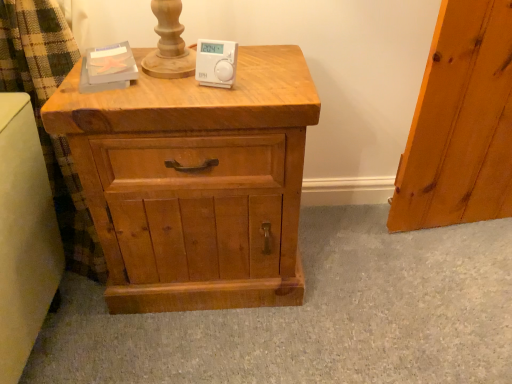
This screenshot has width=512, height=384. Find the location of `natural wood chest of drawers at center`. natural wood chest of drawers at center is located at coordinates (195, 182).

Image resolution: width=512 pixels, height=384 pixels. Describe the element at coordinates (195, 182) in the screenshot. I see `natural wood chest of drawers at center` at that location.

What is the approximate height of natural wood chest of drawers at center?

It is 67.10 centimeters.

What is the approximate height of white plastic thermostat at center?

The height of white plastic thermostat at center is 9.66 centimeters.

At what (x,y) coordinates should I click in order to perform the action: click on white plastic thermostat at center. Please return your answer as a coordinate pair (x, y). This screenshot has width=512, height=384. Looking at the image, I should click on (216, 63).

Describe the element at coordinates (216, 63) in the screenshot. The image size is (512, 384). I see `white plastic thermostat at center` at that location.

Where is `natural wood chest of drawers at center`? The width and height of the screenshot is (512, 384). natural wood chest of drawers at center is located at coordinates (195, 182).

Which object is positioned more to the right, white plastic thermostat at center or natural wood chest of drawers at center?

From the viewer's perspective, white plastic thermostat at center appears more on the right side.

Is white plastic thermostat at center positioned behind natural wood chest of drawers at center?

Yes, it is.

Between point (227, 53) and point (60, 121), which one is positioned in front?

The point (60, 121) is closer.

In the scene shown: From the image's perspective, is white plastic thermostat at center located beneath natural wood chest of drawers at center?

No.

From a real-world perspective, between white plastic thermostat at center and natural wood chest of drawers at center, who is vertically lower?

natural wood chest of drawers at center.

Considering the relative sizes of white plastic thermostat at center and natural wood chest of drawers at center in the image provided, is white plastic thermostat at center wider than natural wood chest of drawers at center?

No, white plastic thermostat at center is not wider than natural wood chest of drawers at center.

Which of these two, white plastic thermostat at center or natural wood chest of drawers at center, stands shorter?

white plastic thermostat at center is shorter.

Considering the sizes of objects white plastic thermostat at center and natural wood chest of drawers at center in the image provided, who is bigger, white plastic thermostat at center or natural wood chest of drawers at center?

natural wood chest of drawers at center is bigger.

Is natural wood chest of drawers at center a part of white plastic thermostat at center?

No, natural wood chest of drawers at center is not a part of white plastic thermostat at center.

Are white plastic thermostat at center and natural wood chest of drawers at center located far from each other?

No, white plastic thermostat at center is not far from natural wood chest of drawers at center.

Is white plastic thermostat at center oriented away from natural wood chest of drawers at center?

No.

I want to click on ipod on the right of natural wood chest of drawers at center, so click(x=216, y=63).

Does natural wood chest of drawers at center appear on the right side of white plastic thermostat at center?

No.

Which is behind, natural wood chest of drawers at center or white plastic thermostat at center?

white plastic thermostat at center is behind.

Between point (267, 90) and point (202, 66), which one is positioned behind?

Positioned behind is point (202, 66).

From the image's perspective, who appears lower, natural wood chest of drawers at center or white plastic thermostat at center?

natural wood chest of drawers at center is shown below in the image.

From a real-world perspective, between natural wood chest of drawers at center and white plastic thermostat at center, who is vertically higher?

In real-world perspective, white plastic thermostat at center is above.

Can you confirm if natural wood chest of drawers at center is thinner than white plastic thermostat at center?

No.

Is natural wood chest of drawers at center shorter than white plastic thermostat at center?

No, natural wood chest of drawers at center is not shorter than white plastic thermostat at center.

Based on their sizes in the image, would you say natural wood chest of drawers at center is bigger or smaller than white plastic thermostat at center?

In the image, natural wood chest of drawers at center appears to be larger than white plastic thermostat at center.

Can we say natural wood chest of drawers at center lies outside white plastic thermostat at center?

Yes.

Is natural wood chest of drawers at center touching white plastic thermostat at center?

They are not placed beside each other.

Does natural wood chest of drawers at center turn towards white plastic thermostat at center?

No.

Measure the distance between natural wood chest of drawers at center and white plastic thermostat at center.

natural wood chest of drawers at center is 11.78 inches from white plastic thermostat at center.

Find the location of a particular element. This screenshot has width=512, height=384. ipod that is behind the natural wood chest of drawers at center is located at coordinates (216, 63).

Where is `ipod above the natural wood chest of drawers at center (from the image's perspective)`? The height and width of the screenshot is (384, 512). ipod above the natural wood chest of drawers at center (from the image's perspective) is located at coordinates (216, 63).

Find the location of a particular element. ipod above the natural wood chest of drawers at center (from a real-world perspective) is located at coordinates (216, 63).